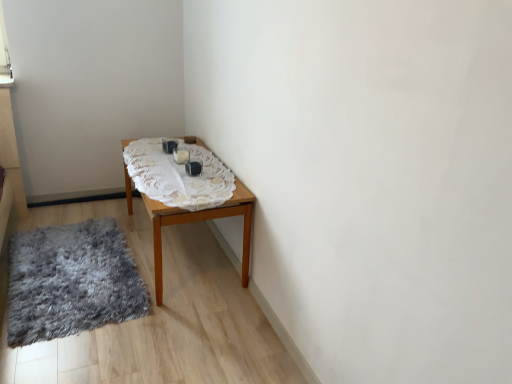
You are a GUI agent. You are given a task and a screenshot of the screen. Output one action in this format:
    pyautogui.click(x=<x>, y=<y>)
    Task: Click on the vacant space that's between wooden table at center and shaggy gray rug at lower left
    The image size is (512, 384).
    Given the screenshot: What is the action you would take?
    pyautogui.click(x=111, y=218)